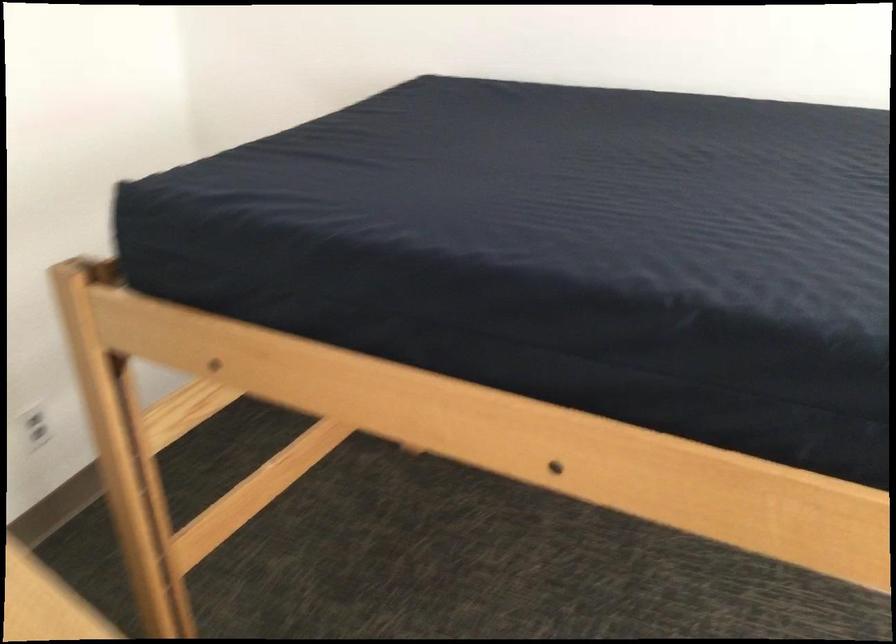
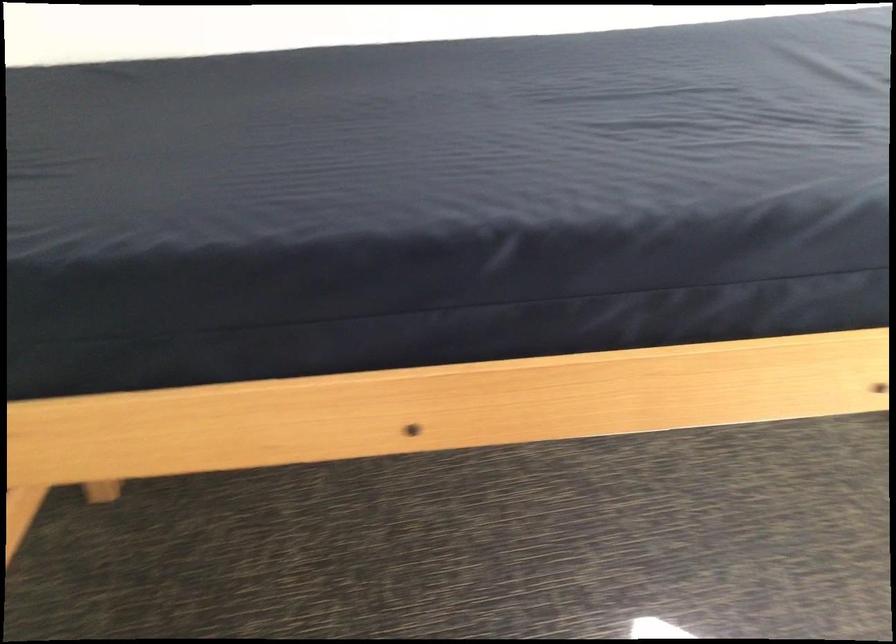
Find the pixel in the second image that matches point 455,310 in the first image.

(254, 308)